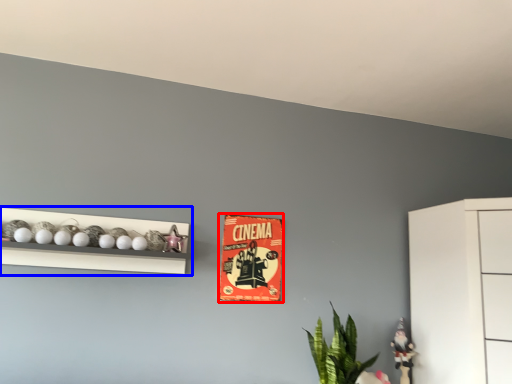
Question: Among these objects, which one is farthest to the camera, postcard (highlighted by a red box) or shelf (highlighted by a blue box)?

Choices:
 (A) postcard
 (B) shelf

Answer: (A)